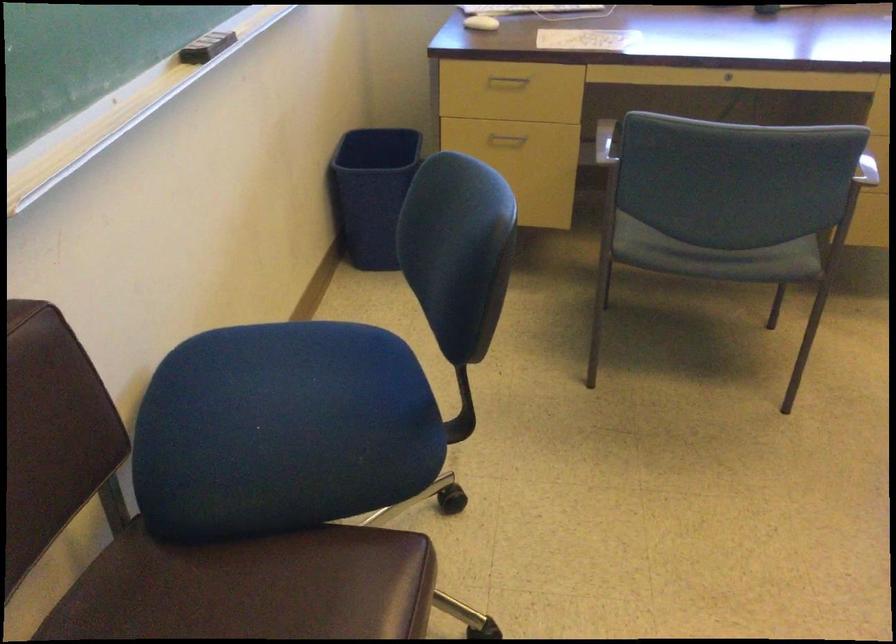
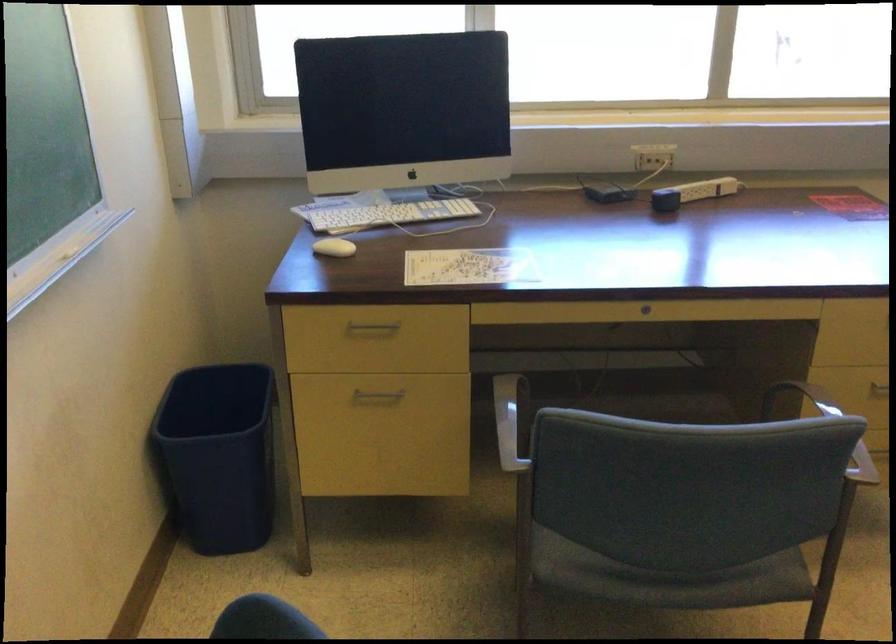
Locate, in the second image, the point that corresponds to [376,187] in the first image.

(217, 456)